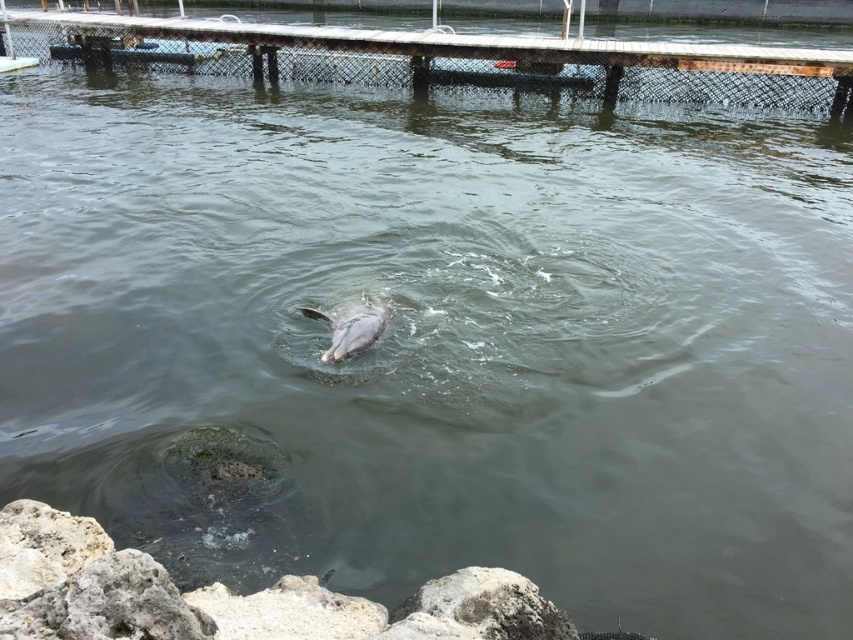
You are a marine biologist observing the dolphin habitat. You need to place a buoy between the wooden dock at upper center and the gray rough rock at lower center. Based on their positions, which object should the buoy be closer to?

The wooden dock at upper center is to the left of gray rough rock at lower center, so the buoy should be placed closer to the gray rough rock at lower center to be between them.

You are a marine biologist observing the dolphin habitat. You need to place a small sensor on the wooden dock at upper center or the gray rough rock at lower center. Which object can accommodate the sensor without it being easily dislodged by water currents, considering their sizes?

The wooden dock at upper center has a larger size compared to the gray rough rock at lower center, so the sensor would be more stable and less likely to be dislodged by water currents on the wooden dock at upper center.